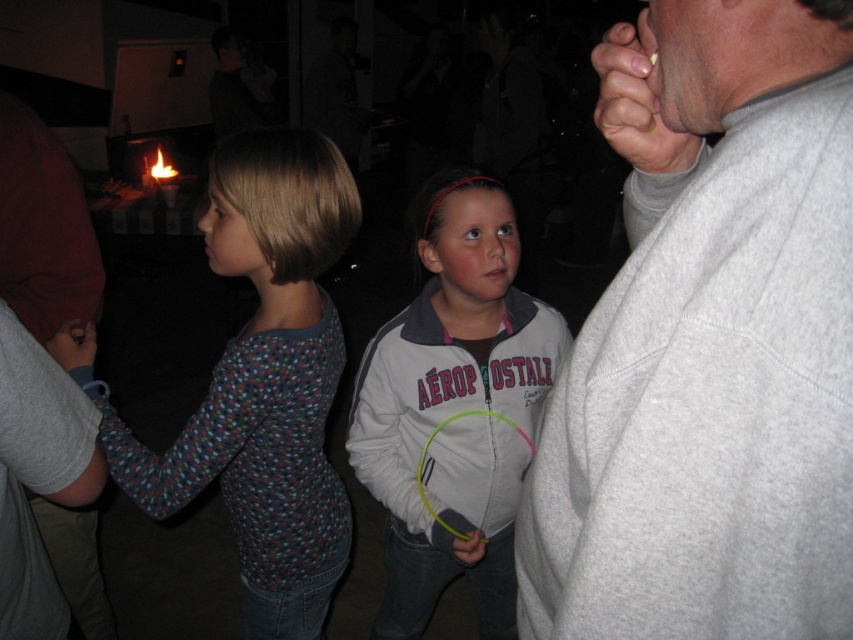
You are a photographer trying to capture a closeup of the multicolored knit sweater at left and the gray matte hand at upper right in the dimly lit room. Since the camera can only focus on one object at a time, which object should you choose to ensure it fills the frame more?

The multicolored knit sweater at left is wider than the gray matte hand at upper right, so you should choose the multicolored knit sweater at left to ensure it fills the frame more.

You are organizing a charity clothing drive and need to decide which items to donate based on size. You have two options from the image provided. Which of the two items, the gray fleece sweatshirt at right or the multicolored knit sweater at left, is smaller and thus more suitable for a child?

The gray fleece sweatshirt at right is smaller than the multicolored knit sweater at left, making it more suitable for a child.

You are a photographer standing at the center of the room. You want to take a closeup photo of the multicolored knit sweater at left without moving any objects. Can you get within 1 meter of the sweater?

The multicolored knit sweater at left is 1.20 meters away from the camera, so yes, you can get within 1 meter of the sweater by moving closer.